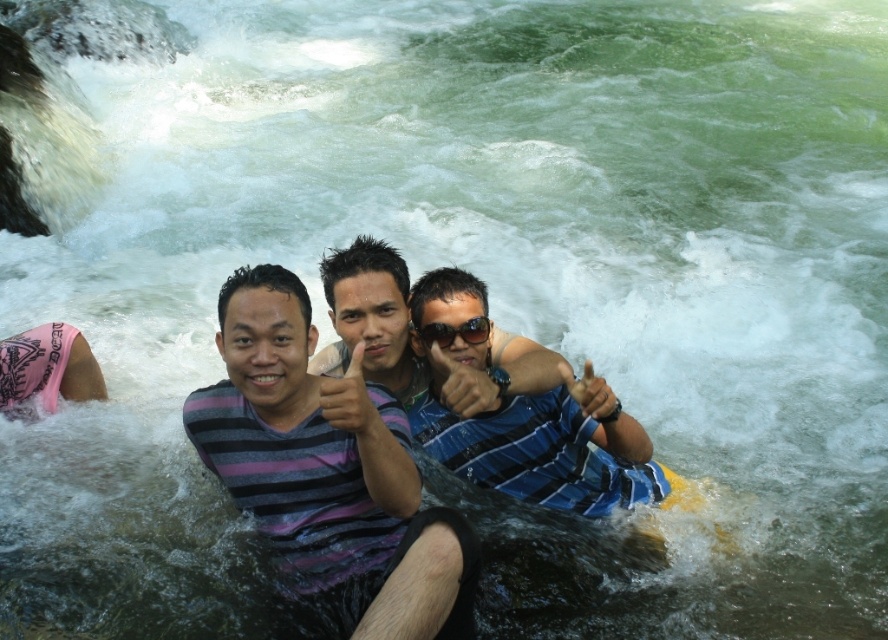
Is striped fabric shirt at center smaller than striped fabric man at center?

No, striped fabric shirt at center is not smaller than striped fabric man at center.

Between point (284, 339) and point (509, 358), which one is positioned behind?

Positioned behind is point (509, 358).

Is point (295, 301) farther from viewer compared to point (444, 380)?

No, it is in front of (444, 380).

Where is `striped fabric shirt at center`? striped fabric shirt at center is located at coordinates (328, 470).

Can you confirm if blue striped shirt at center is shorter than sunglasses at center?

No, blue striped shirt at center is not shorter than sunglasses at center.

Between blue striped shirt at center and sunglasses at center, which one has less height?

With less height is sunglasses at center.

Is point (425, 448) farther from viewer compared to point (448, 337)?

Yes.

Identify the location of blue striped shirt at center. (546, 448).

Who is lower down, blue striped shirt at center or striped fabric man at center?

blue striped shirt at center is below.

Can you confirm if blue striped shirt at center is positioned below striped fabric man at center?

Indeed, blue striped shirt at center is positioned under striped fabric man at center.

Is point (489, 410) farther from camera compared to point (534, 368)?

Yes, it is.

Where is `blue striped shirt at center`? blue striped shirt at center is located at coordinates (546, 448).